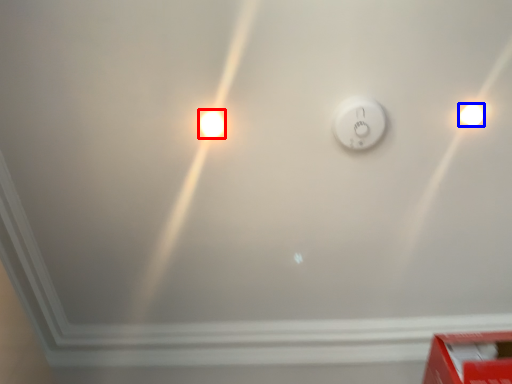
Question: Which object is further to the camera taking this photo, light bulb (highlighted by a red box) or light bulb (highlighted by a blue box)?

Choices:
 (A) light bulb
 (B) light bulb

Answer: (A)